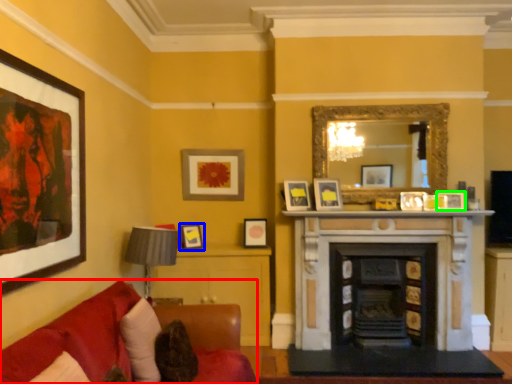
Question: Based on their relative distances, which object is farther from studio couch (highlighted by a red box)? Choose from picture frame (highlighted by a blue box) and picture frame (highlighted by a green box).

Choices:
 (A) picture frame
 (B) picture frame

Answer: (B)